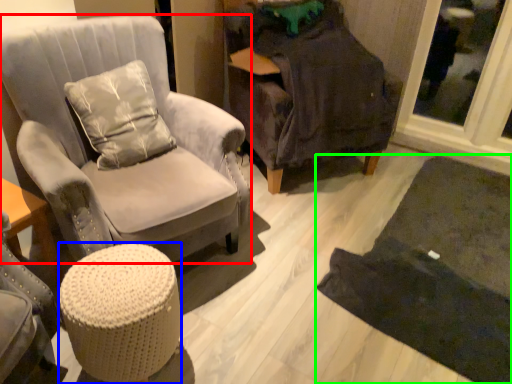
Question: Estimate the real-world distances between objects in this image. Which object is closer to chair (highlighted by a red box), stool (highlighted by a blue box) or mat (highlighted by a green box)?

Choices:
 (A) stool
 (B) mat

Answer: (A)